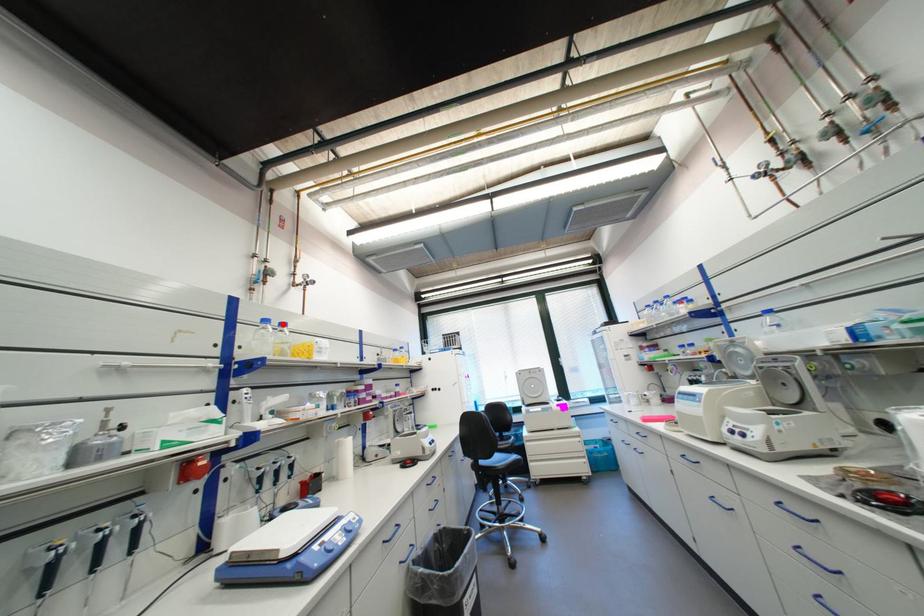
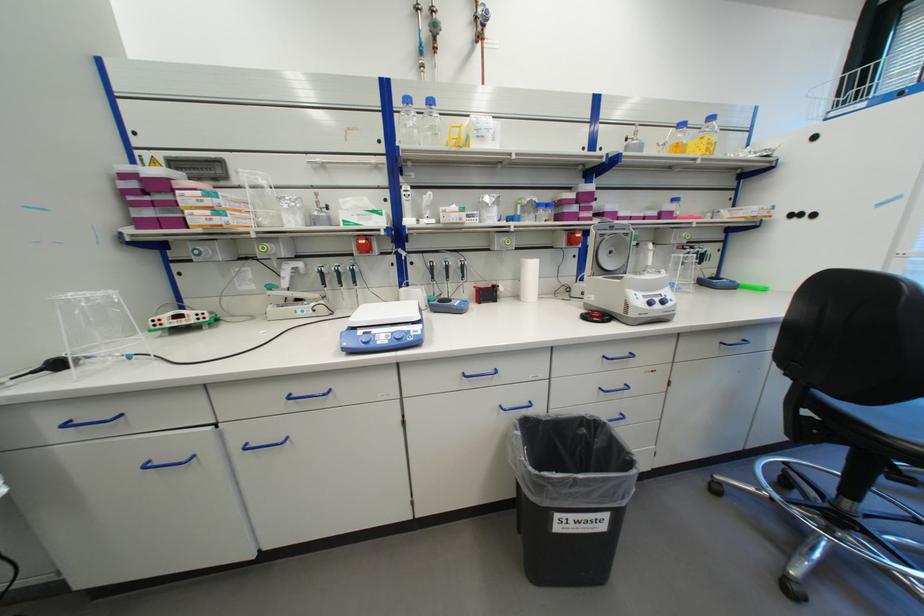
In the second image, find the point that corresponds to the highlighted location in the first image.

(428, 103)